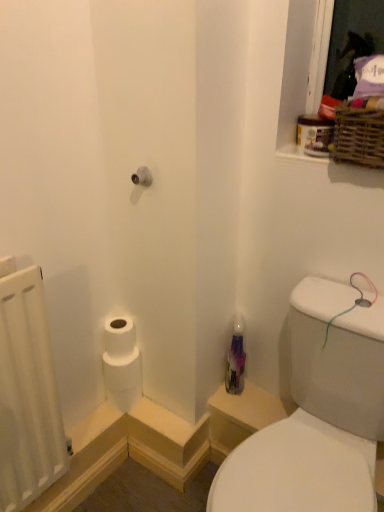
Question: In terms of height, does white matte radiator at left look taller or shorter compared to translucent purple bottle at center?

Choices:
 (A) tall
 (B) short

Answer: (A)

Question: Relative to translucent purple bottle at center, is white matte radiator at left in front or behind?

Choices:
 (A) front
 (B) behind

Answer: (A)

Question: Which object is positioned farthest from the white matte toilet paper at lower left?

Choices:
 (A) translucent purple bottle at center
 (B) woven brown basket at upper right
 (C) white matte radiator at left
 (D) transparent plastic bottle at lower right

Answer: (B)

Question: Estimate the real-world distances between objects in this image. Which object is closer to the woven brown basket at upper right?

Choices:
 (A) translucent purple bottle at center
 (B) transparent plastic bottle at lower right
 (C) white matte toilet paper at lower left
 (D) white matte radiator at left

Answer: (B)